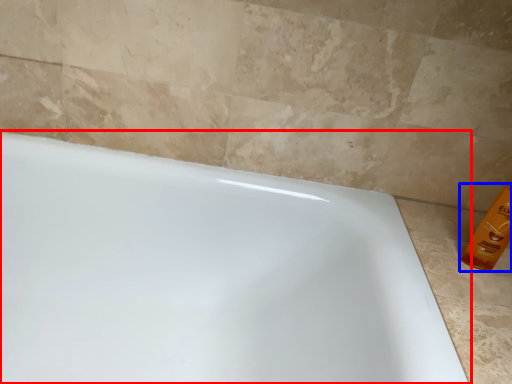
Question: Which of the following is the closest to the observer, bathtub (highlighted by a red box) or cleaning product (highlighted by a blue box)?

Choices:
 (A) bathtub
 (B) cleaning product

Answer: (A)